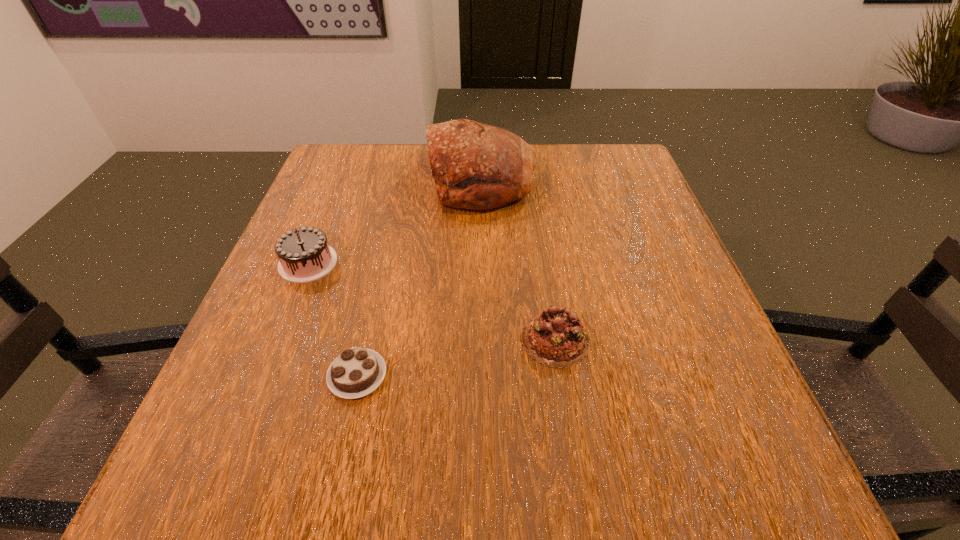
At what (x,y) coordinates should I click in order to perform the action: click on the tallest object. Please return your answer as a coordinate pair (x, y). The width and height of the screenshot is (960, 540). Looking at the image, I should click on (476, 166).

Locate an element on the screen. The height and width of the screenshot is (540, 960). the farthest object is located at coordinates (476, 166).

You are a GUI agent. You are given a task and a screenshot of the screen. Output one action in this format:
    pyautogui.click(x=<x>, y=<y>)
    Task: Click on the tallest chocolate cake
    
    Given the screenshot: What is the action you would take?
    pyautogui.click(x=304, y=255)

Find the location of a particular element. The height and width of the screenshot is (540, 960). the third shortest object is located at coordinates (304, 255).

Find the location of a particular element. The image size is (960, 540). the third tallest object is located at coordinates (556, 338).

This screenshot has height=540, width=960. Find the location of `the rightmost chocolate cake`. the rightmost chocolate cake is located at coordinates (556, 338).

Locate an element on the screen. The height and width of the screenshot is (540, 960). the shortest object is located at coordinates (356, 372).

Locate an element on the screen. Image resolution: width=960 pixels, height=540 pixels. the second chocolate cake from right to left is located at coordinates (356, 372).

In order to click on vacant region located at the sliced front of the tallest object in this screenshot , I will do `click(351, 181)`.

The image size is (960, 540). Identify the location of vacant space located 0.080m at the sliced front of the tallest object. (396, 181).